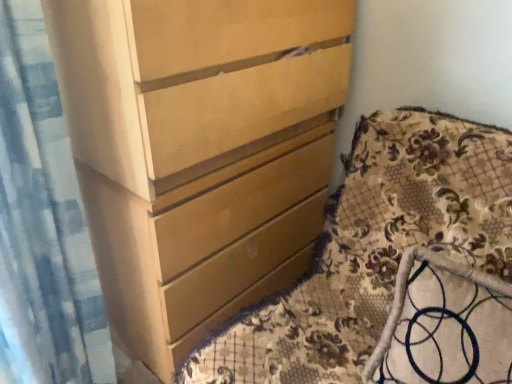
Question: Can you confirm if matte wood chest of drawers at center is positioned to the left of blue textured fabric at left?

Choices:
 (A) no
 (B) yes

Answer: (A)

Question: Would you consider matte wood chest of drawers at center to be distant from blue textured fabric at left?

Choices:
 (A) no
 (B) yes

Answer: (A)

Question: Does matte wood chest of drawers at center have a greater height compared to blue textured fabric at left?

Choices:
 (A) no
 (B) yes

Answer: (B)

Question: Does matte wood chest of drawers at center have a larger size compared to blue textured fabric at left?

Choices:
 (A) no
 (B) yes

Answer: (B)

Question: Does matte wood chest of drawers at center touch blue textured fabric at left?

Choices:
 (A) no
 (B) yes

Answer: (A)

Question: Relative to matte wood chest of drawers at center, is floral fabric cushion at lower right in front or behind?

Choices:
 (A) behind
 (B) front

Answer: (B)

Question: Is floral fabric cushion at lower right taller or shorter than matte wood chest of drawers at center?

Choices:
 (A) short
 (B) tall

Answer: (A)

Question: Is point (505, 289) positioned closer to the camera than point (234, 185)?

Choices:
 (A) closer
 (B) farther

Answer: (A)

Question: Is floral fabric cushion at lower right bigger or smaller than matte wood chest of drawers at center?

Choices:
 (A) big
 (B) small

Answer: (B)

Question: Is floral fabric cushion at lower right in front of or behind blue textured fabric at left in the image?

Choices:
 (A) behind
 (B) front

Answer: (B)

Question: In terms of width, does floral fabric cushion at lower right look wider or thinner when compared to blue textured fabric at left?

Choices:
 (A) wide
 (B) thin

Answer: (A)

Question: Is floral fabric cushion at lower right spatially inside blue textured fabric at left, or outside of it?

Choices:
 (A) inside
 (B) outside

Answer: (B)

Question: Is point (456, 261) positioned closer to the camera than point (75, 374)?

Choices:
 (A) closer
 (B) farther

Answer: (A)

Question: From a real-world perspective, relative to floral fabric cushion at lower right, is matte wood chest of drawers at center vertically above or below?

Choices:
 (A) below
 (B) above

Answer: (B)

Question: Is matte wood chest of drawers at center bigger or smaller than floral fabric cushion at lower right?

Choices:
 (A) big
 (B) small

Answer: (A)